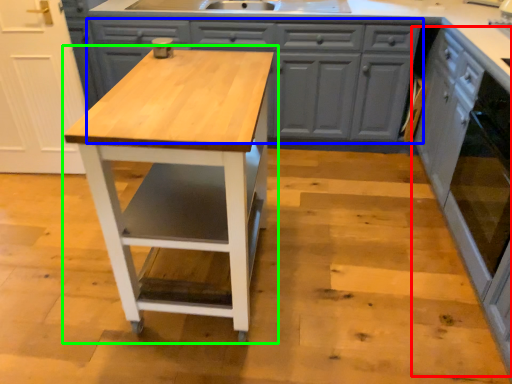
Question: Estimate the real-world distances between objects in this image. Which object is farther from cabinetry (highlighted by a red box), cabinetry (highlighted by a blue box) or table (highlighted by a green box)?

Choices:
 (A) cabinetry
 (B) table

Answer: (B)